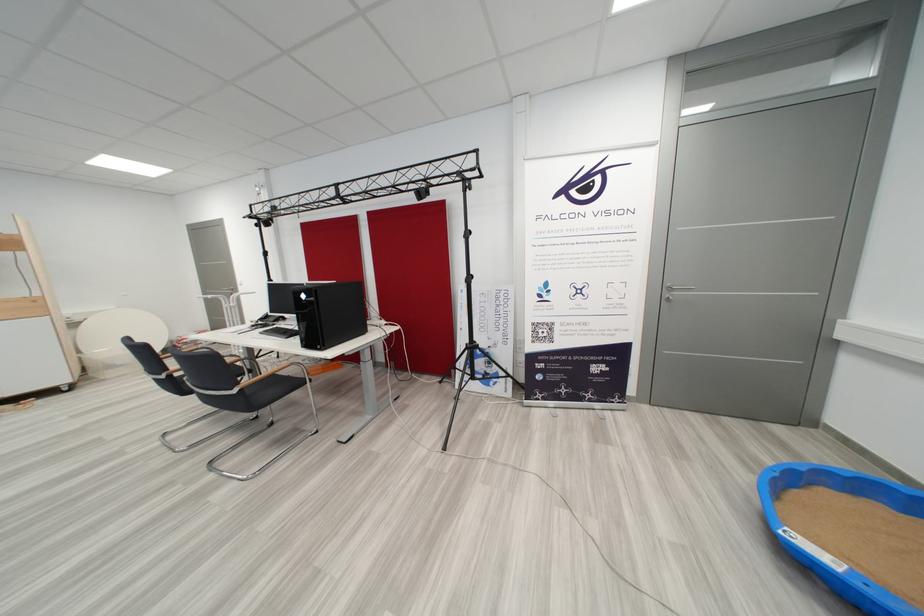
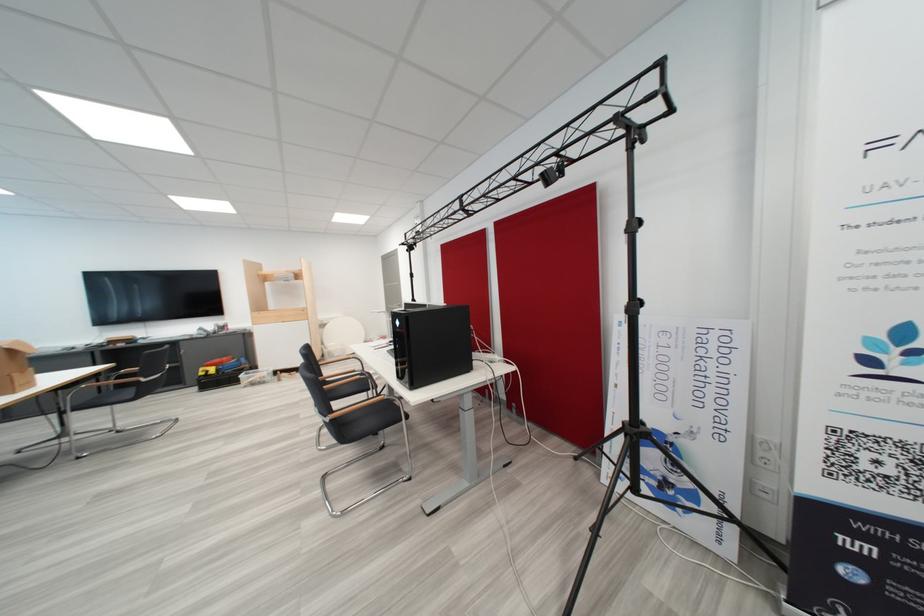
Locate, in the second image, the point that corresponds to point (516, 345) in the first image.

(731, 439)